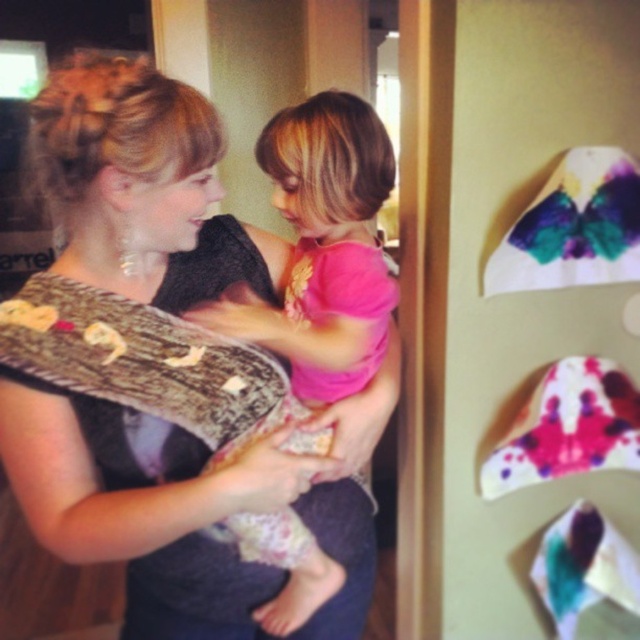
Does matte black dress at center appear on the left side of pink fabric at center?

Yes, matte black dress at center is to the left of pink fabric at center.

You are a GUI agent. You are given a task and a screenshot of the screen. Output one action in this format:
    pyautogui.click(x=<x>, y=<y>)
    Task: Click on the matte black dress at center
    Image resolution: width=640 pixels, height=640 pixels.
    Given the screenshot: What is the action you would take?
    pyautogui.click(x=156, y=369)

Identify the location of matte black dress at center. This screenshot has width=640, height=640. (156, 369).